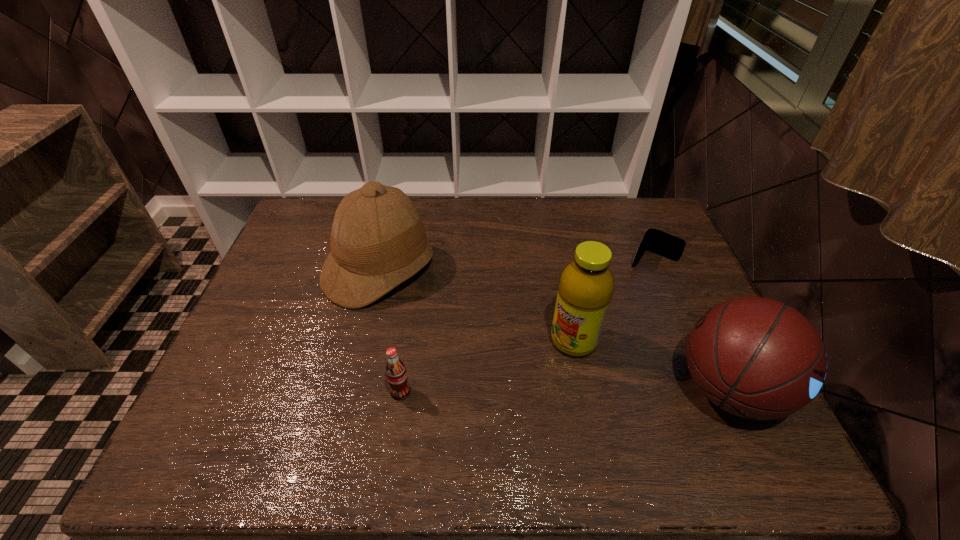
Locate an element on the screen. The image size is (960, 540). free spot between the basketball and the shortest object is located at coordinates (691, 324).

Locate an element on the screen. This screenshot has width=960, height=540. unoccupied position between the second shortest object and the wallet is located at coordinates (526, 326).

The height and width of the screenshot is (540, 960). Identify the location of vacant space that's between the hat and the wallet. (516, 265).

Identify the location of unoccupied position between the soda and the third object from left to right. This screenshot has height=540, width=960. (487, 366).

What are the coordinates of `vacant area that lies between the basketball and the fruit juice` in the screenshot? It's located at (652, 365).

I want to click on vacant region between the hat and the third object from left to right, so click(476, 306).

Locate an element on the screen. Image resolution: width=960 pixels, height=540 pixels. object that stands as the second closest to the third object from left to right is located at coordinates (656, 241).

Choose which object is the nearest neighbor to the second shortest object. Please provide its 2D coordinates. Your answer should be formatted as a tuple, i.e. [(x, y)], where the tuple contains the x and y coordinates of a point satisfying the conditions above.

[(378, 240)]

At what (x,y) coordinates should I click in order to perform the action: click on vacant point that satisfies the following two spatial constraints: 1. on the back side of the basketball; 2. on the right side of the soda. Please return your answer as a coordinate pair (x, y). This screenshot has width=960, height=540. Looking at the image, I should click on (401, 389).